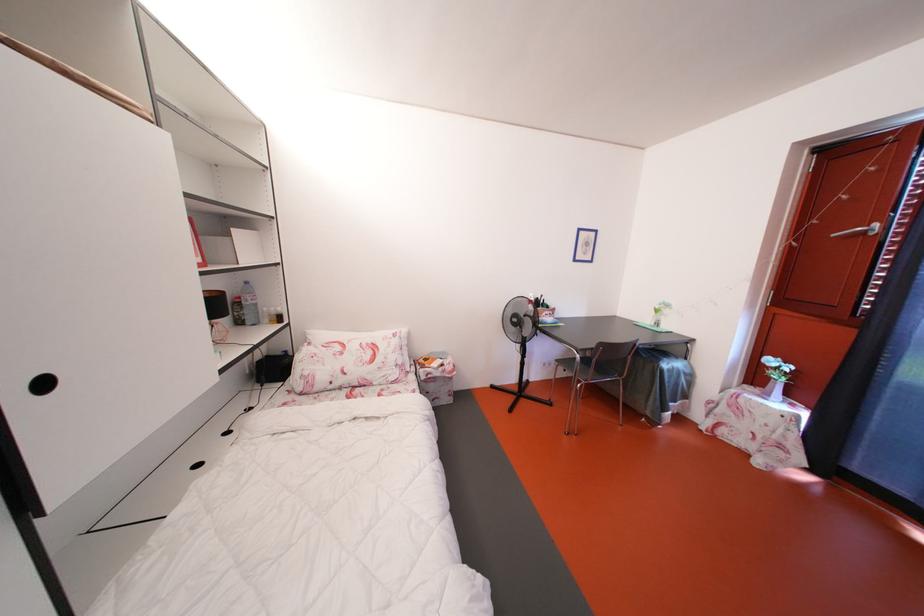
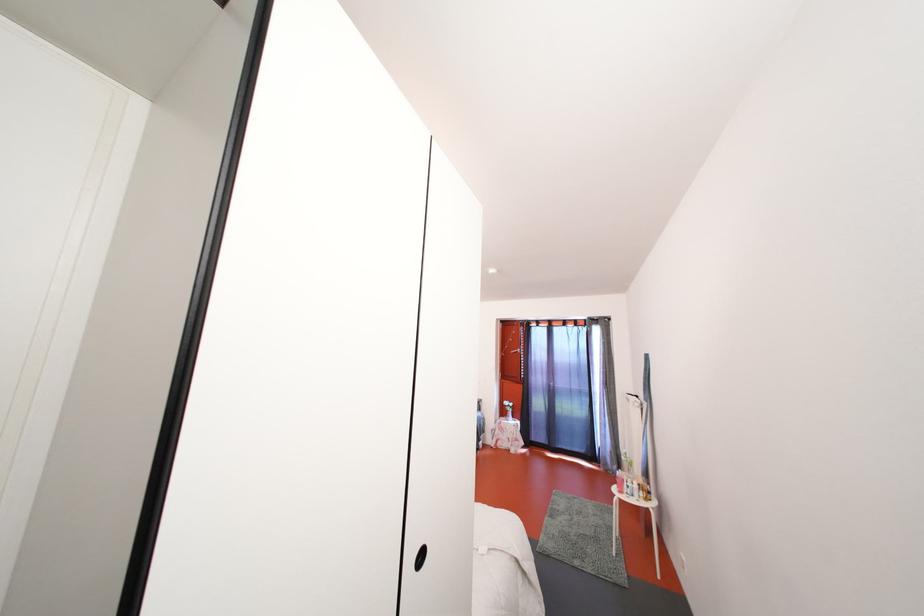
Question: I am providing you with two images of the same scene from different viewpoints. Please identify which objects are invisible in image2.

Choices:
 (A) white pump bottle
 (B) glass sauce bottle
 (C) black recessed handle
 (D) black circular handle

Answer: (D)